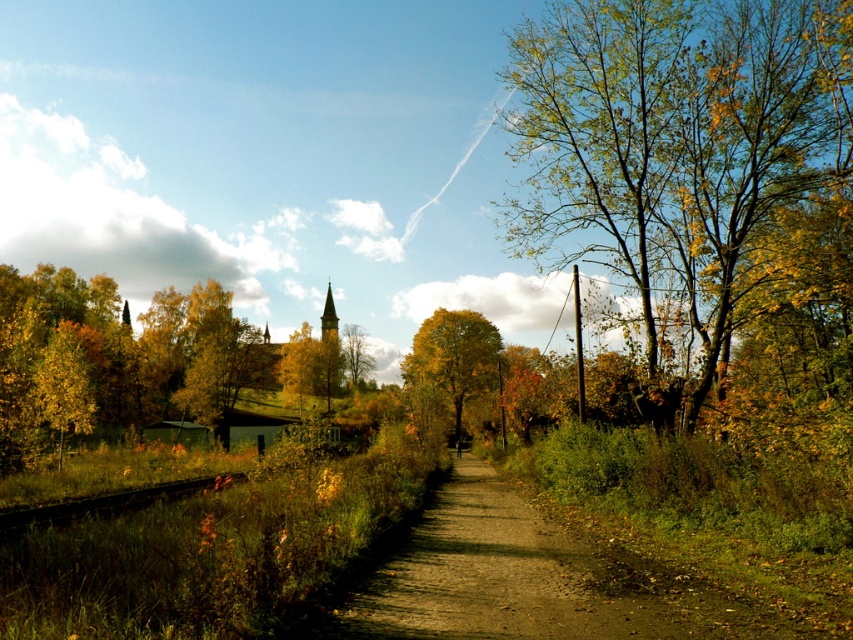
Can you confirm if green leafy tree at right is positioned to the left of golden yellow leaves at center?

Incorrect, green leafy tree at right is not on the left side of golden yellow leaves at center.

Where is `green leafy tree at right`? green leafy tree at right is located at coordinates (675, 156).

Locate an element on the screen. Image resolution: width=853 pixels, height=640 pixels. green leafy tree at right is located at coordinates (675, 156).

Which is in front, point (732, 304) or point (326, 291)?

Point (732, 304)

Locate an element on the screen. This screenshot has width=853, height=640. green leafy tree at right is located at coordinates 675,156.

Who is more distant from viewer, (483, 380) or (329, 324)?

Positioned behind is point (329, 324).

Locate an element on the screen. yellow-green foliage at center is located at coordinates (454, 355).

Where is `yellow-green foliage at center`? The width and height of the screenshot is (853, 640). yellow-green foliage at center is located at coordinates (454, 355).